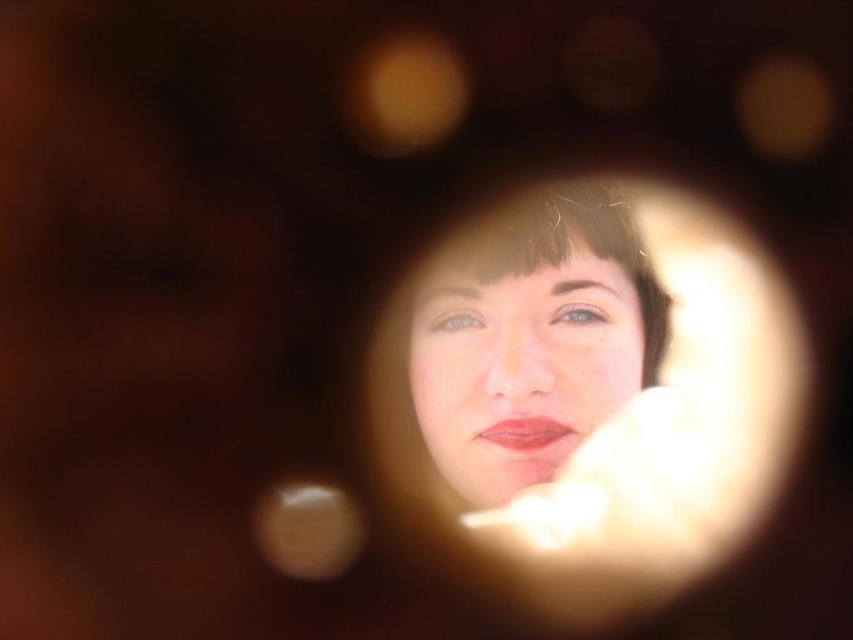
Who is more forward, [566,305] or [486,436]?

Point [566,305] is in front.

Is point (527, 269) in front of point (541, 428)?

That is True.

What do you see at coordinates (521, 360) in the screenshot? I see `smooth skin face at center` at bounding box center [521, 360].

Where is `smooth skin face at center`? This screenshot has width=853, height=640. smooth skin face at center is located at coordinates (521, 360).